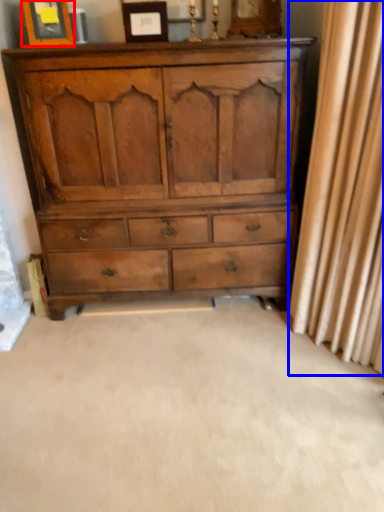
Question: Which point is further to the camera, picture frame (highlighted by a red box) or curtain (highlighted by a blue box)?

Choices:
 (A) picture frame
 (B) curtain

Answer: (A)